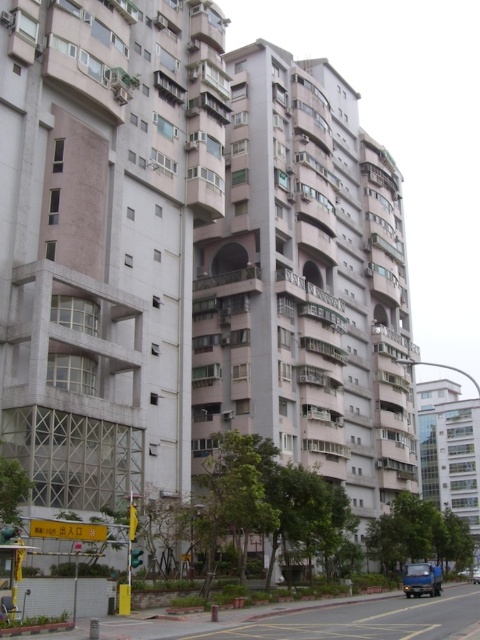
You are a delivery driver who needs to park your vehicle in the parking space marked by the yellow lines. You have a blue matte truck at lower right and a metallic silver car at center. Which vehicle will require a wider parking space?

The blue matte truck at lower right requires a wider parking space because it has a larger size compared to the metallic silver car at center.